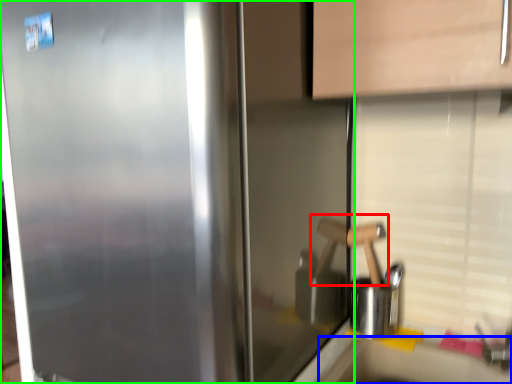
Question: Which is nearer to the door handle (highlighted by a red box)? counter top (highlighted by a blue box) or refrigerator (highlighted by a green box).

Choices:
 (A) counter top
 (B) refrigerator

Answer: (A)